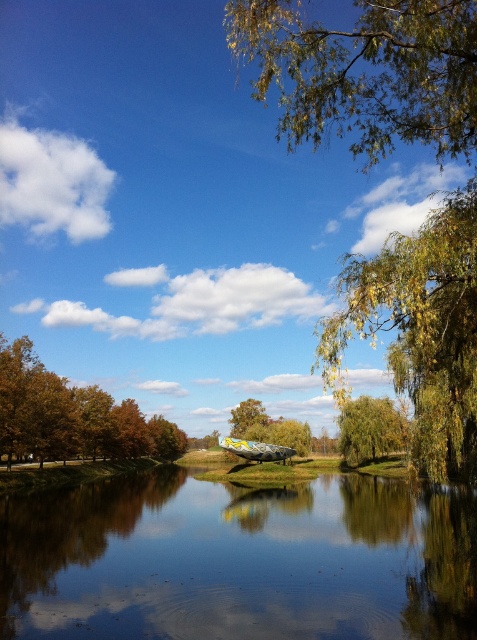
Question: Can you confirm if brown matte tree at lower left is positioned above green matte tree at center?

Choices:
 (A) yes
 (B) no

Answer: (A)

Question: Is smooth reflective water at center above yellow-green leaves at upper right?

Choices:
 (A) no
 (B) yes

Answer: (A)

Question: Which object is the closest to the yellow-green leaves at upper right?

Choices:
 (A) yellow-green leaves at center
 (B) green matte tree at center
 (C) green leafy branches at upper center
 (D) smooth reflective water at center

Answer: (D)

Question: Based on their relative distances, which object is farther from the yellow-green leaves at center?

Choices:
 (A) yellow-green leaves at upper right
 (B) green matte tree at center
 (C) brown matte tree at lower left

Answer: (B)

Question: Which point is closer to the camera?

Choices:
 (A) brown matte tree at lower left
 (B) green matte tree at center

Answer: (A)

Question: Does smooth reflective water at center have a larger size compared to yellow-green leaves at center?

Choices:
 (A) no
 (B) yes

Answer: (B)